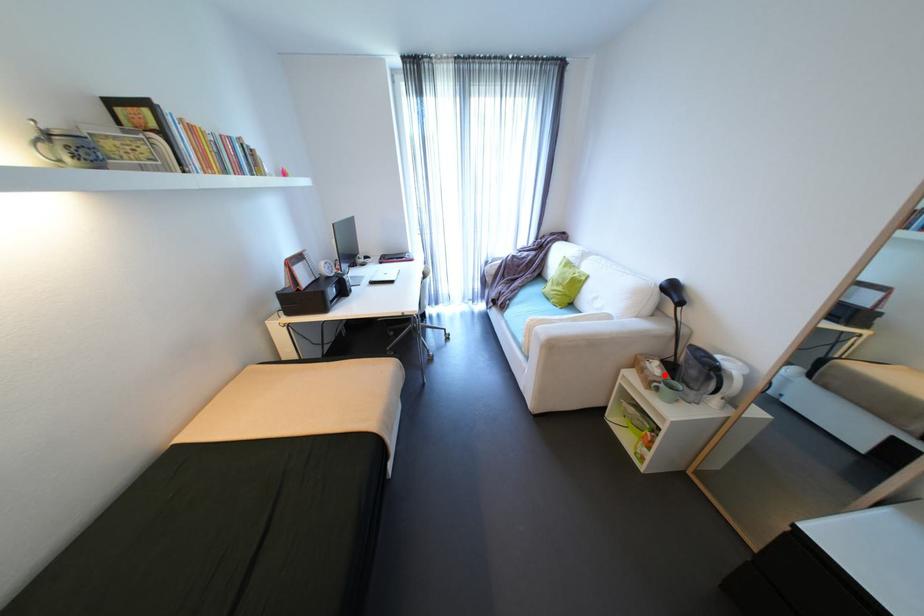
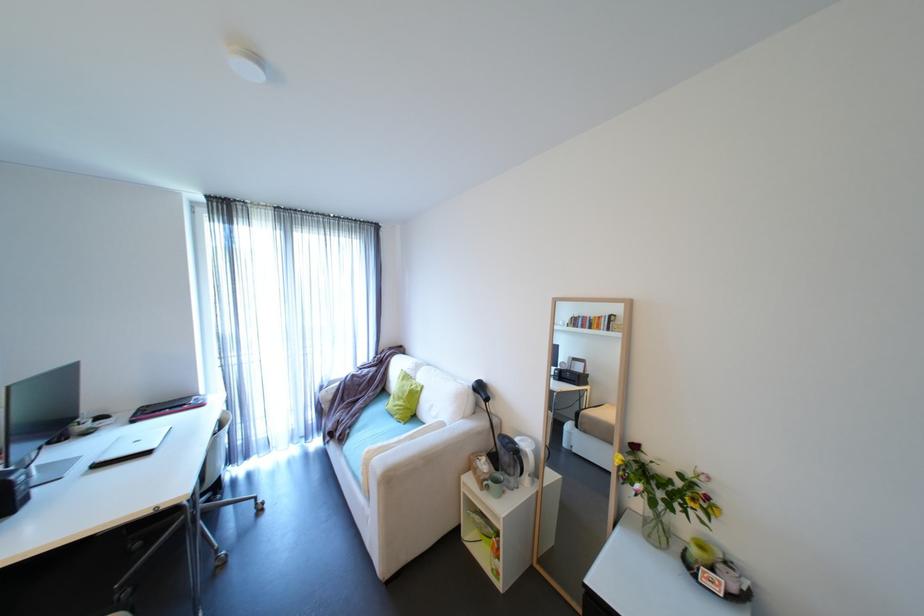
Question: I am providing you with two images of the same scene from different viewpoints. Given a red point in image1, look at the same physical point in image2. Is it:

Choices:
 (A) Closer to the viewpoint
 (B) Farther from the viewpoint

Answer: (B)